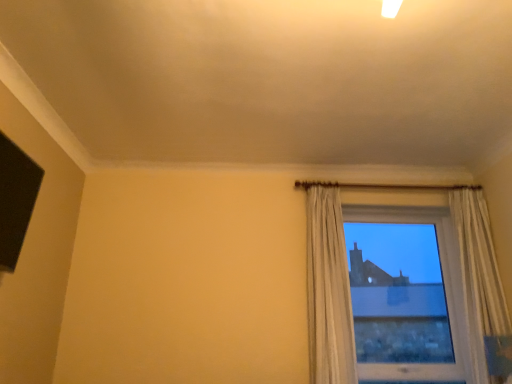
Question: Looking at their shapes, would you say transparent glass window at right is wider or thinner than white sheer curtain at right?

Choices:
 (A) thin
 (B) wide

Answer: (A)

Question: Considering their positions, is transparent glass window at right located in front of or behind white sheer curtain at right?

Choices:
 (A) behind
 (B) front

Answer: (A)

Question: In terms of height, does transparent glass window at right look taller or shorter compared to white sheer curtain at right?

Choices:
 (A) tall
 (B) short

Answer: (B)

Question: In terms of height, does white sheer curtain at right look taller or shorter compared to transparent glass window at right?

Choices:
 (A) tall
 (B) short

Answer: (A)

Question: In terms of size, does white sheer curtain at right appear bigger or smaller than transparent glass window at right?

Choices:
 (A) big
 (B) small

Answer: (B)

Question: Which is correct: white sheer curtain at right is inside transparent glass window at right, or outside of it?

Choices:
 (A) inside
 (B) outside

Answer: (B)

Question: From a real-world perspective, relative to transparent glass window at right, is white sheer curtain at right vertically above or below?

Choices:
 (A) above
 (B) below

Answer: (A)